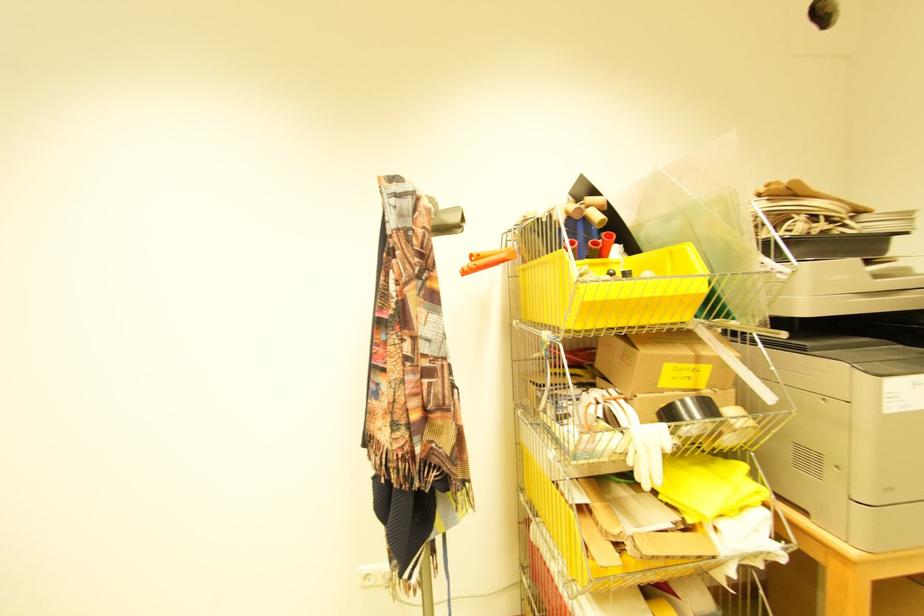
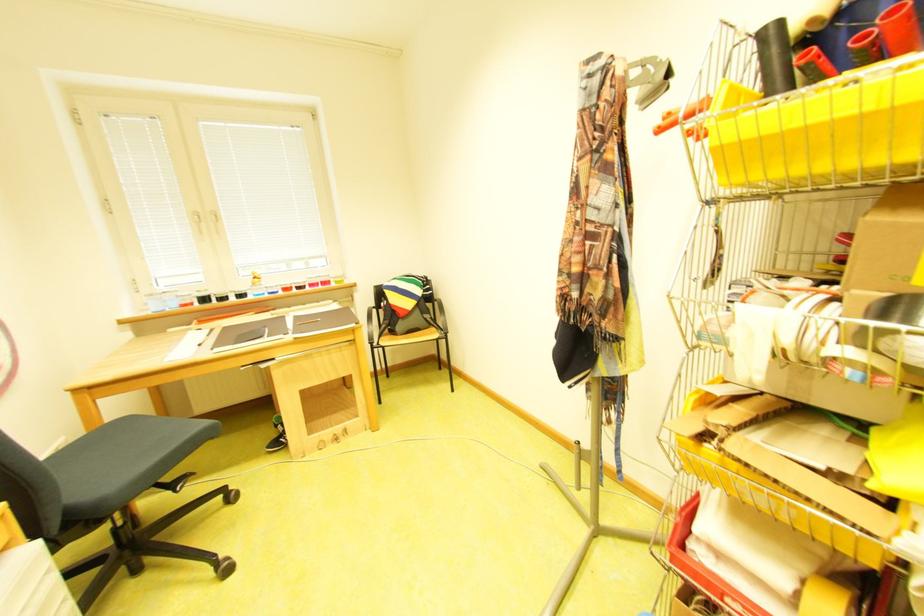
Find the pixel in the second image that matches the point at 492,254 in the first image.

(687, 111)